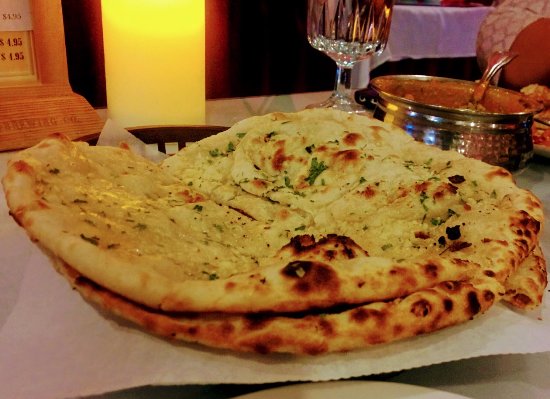
You are a GUI agent. You are given a task and a screenshot of the screen. Output one action in this format:
    pyautogui.click(x=<x>, y=<y>)
    Task: Click on the paper towel
    This screenshot has width=550, height=399.
    Given the screenshot: What is the action you would take?
    pyautogui.click(x=475, y=347)